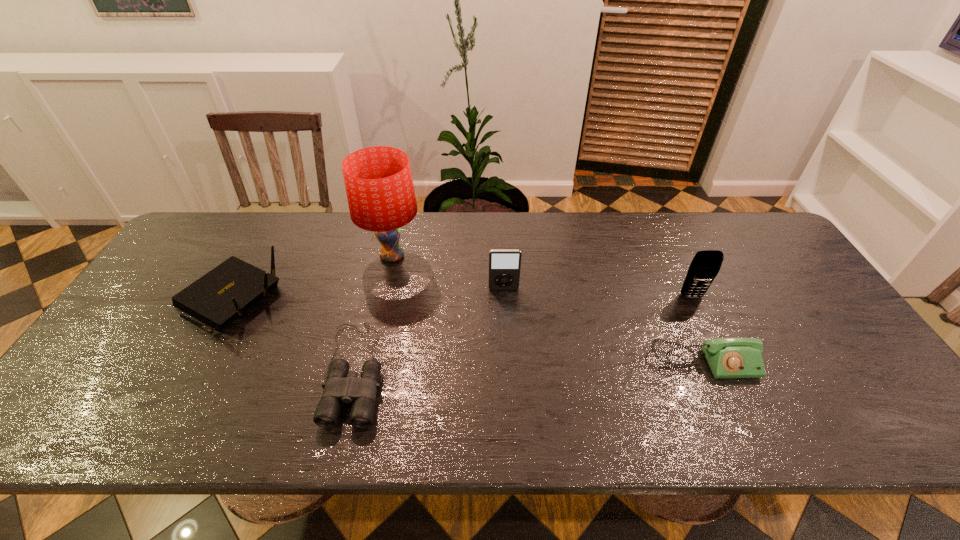
I want to click on blank space located 0.240m on the front of the leftmost object, so click(x=155, y=436).

This screenshot has width=960, height=540. What are the coordinates of `free space located on the dial of the second shortest object` in the screenshot? It's located at (736, 437).

Image resolution: width=960 pixels, height=540 pixels. What are the coordinates of `object that is at the far edge` in the screenshot? It's located at 380,192.

The height and width of the screenshot is (540, 960). In order to click on object at the near edge in this screenshot , I will do `click(342, 386)`.

This screenshot has width=960, height=540. I want to click on object located in the left edge section of the desktop, so click(x=219, y=297).

Locate an element on the screen. This screenshot has width=960, height=540. free spot at the far edge of the desktop is located at coordinates (536, 213).

Locate an element on the screen. blank space at the near edge is located at coordinates (774, 428).

Find the location of a particular element. This screenshot has width=960, height=540. free space at the left edge of the desktop is located at coordinates (133, 318).

Image resolution: width=960 pixels, height=540 pixels. What are the coordinates of `free space at the right edge of the desktop` in the screenshot? It's located at 811,287.

Locate an element on the screen. Image resolution: width=960 pixels, height=540 pixels. free area in between the iPod and the cellular telephone is located at coordinates (597, 293).